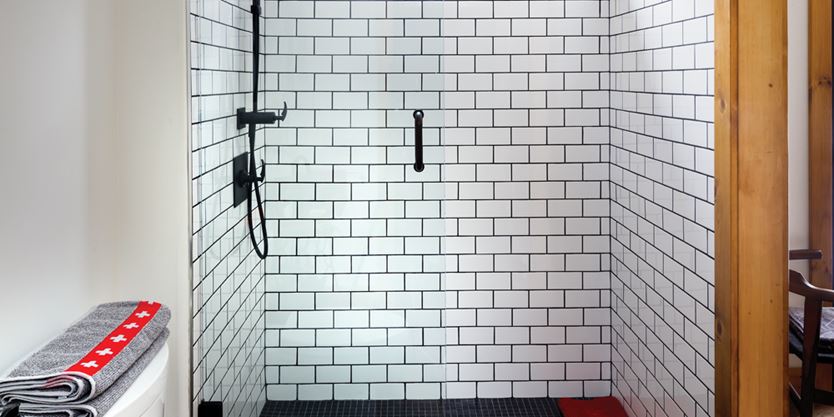
Find the location of `towels`. towels is located at coordinates (83, 358).